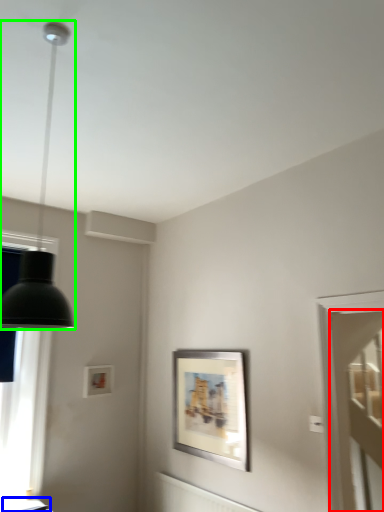
Question: Which object is the closest to the glass door (highlighted by a red box)? Choose among these: table (highlighted by a blue box) or lamp (highlighted by a green box).

Choices:
 (A) table
 (B) lamp

Answer: (A)